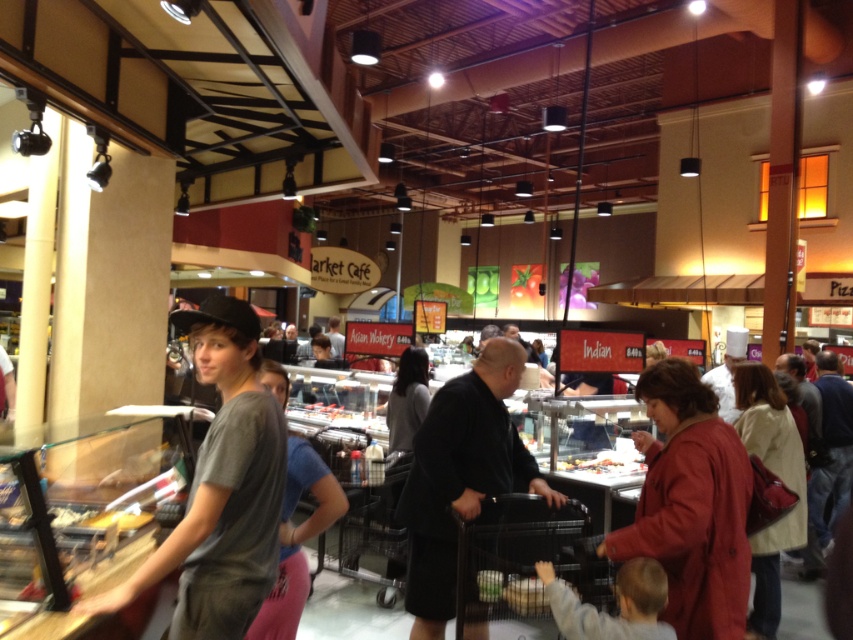
You are standing at the entrance of the market and see the gray cotton t shirt at center. Can you tell me what is located at the point with coordinates (221, 488)?

The gray cotton t shirt at center is located at point (221, 488).

You are a customer at the Market Cafe and need to choose an outfit to wear for a casual dinner. You see a matte red coat at lower right and a gray cotton shirt at center. Which item is larger in size?

The matte red coat at lower right is bigger than the gray cotton shirt at center, so the matte red coat at lower right is the larger item.